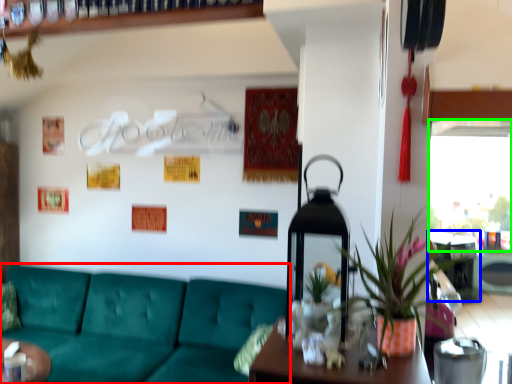
Question: Which object is the farthest from studio couch (highlighted by a red box)? Choose among these: table (highlighted by a blue box) or window screen (highlighted by a green box).

Choices:
 (A) table
 (B) window screen

Answer: (B)